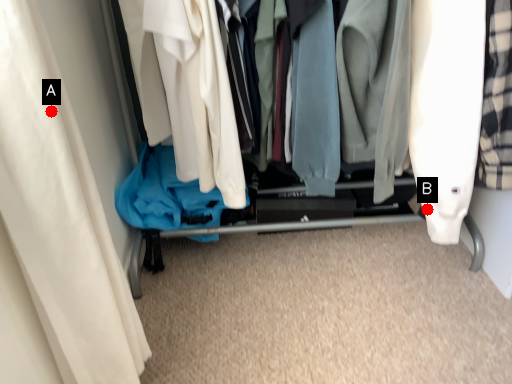
Question: Two points are circled on the image, labeled by A and B beside each circle. Which point appears farthest from the camera in this image?

Choices:
 (A) A is further
 (B) B is further

Answer: (B)